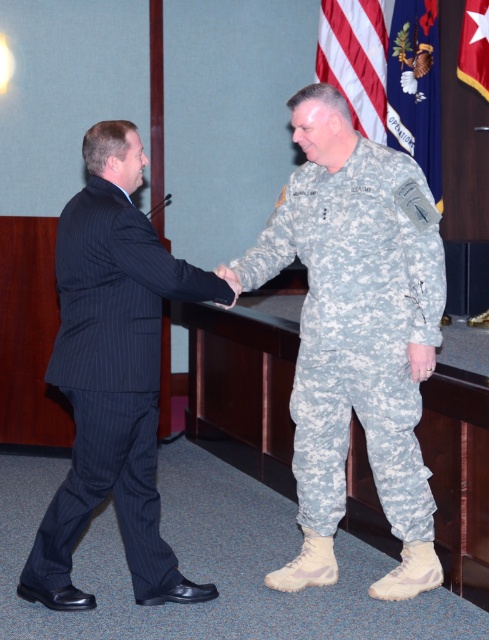
Who is shorter, silk flag at upper center or red fabric flag at upper right?

red fabric flag at upper right

Is silk flag at upper center bigger than red fabric flag at upper right?

Yes.

Between point (407, 77) and point (475, 88), which one is positioned in front?

Point (475, 88) is more forward.

You are a GUI agent. You are given a task and a screenshot of the screen. Output one action in this format:
    pyautogui.click(x=<x>, y=<y>)
    Task: Click on the silk flag at upper center
    
    Given the screenshot: What is the action you would take?
    pyautogui.click(x=416, y=88)

Between point (415, 448) and point (401, 99), which one is positioned behind?

The point (401, 99) is more distant.

Between camouflage fabric uniform at center and silk flag at upper center, which one is positioned lower?

Result: camouflage fabric uniform at center is below.

Which is behind, point (339, 266) or point (439, 132)?

Point (439, 132)

Find the location of a particular element. This screenshot has height=640, width=489. camouflage fabric uniform at center is located at coordinates (357, 326).

Does camouflage fabric uniform at center appear on the left side of black pinstripe suit at left?

In fact, camouflage fabric uniform at center is to the right of black pinstripe suit at left.

Between camouflage fabric uniform at center and black pinstripe suit at left, which one appears on the left side from the viewer's perspective?

From the viewer's perspective, black pinstripe suit at left appears more on the left side.

Who is more forward, (374, 330) or (32, 586)?

Point (32, 586)

Identify the location of camouflage fabric uniform at center. (357, 326).